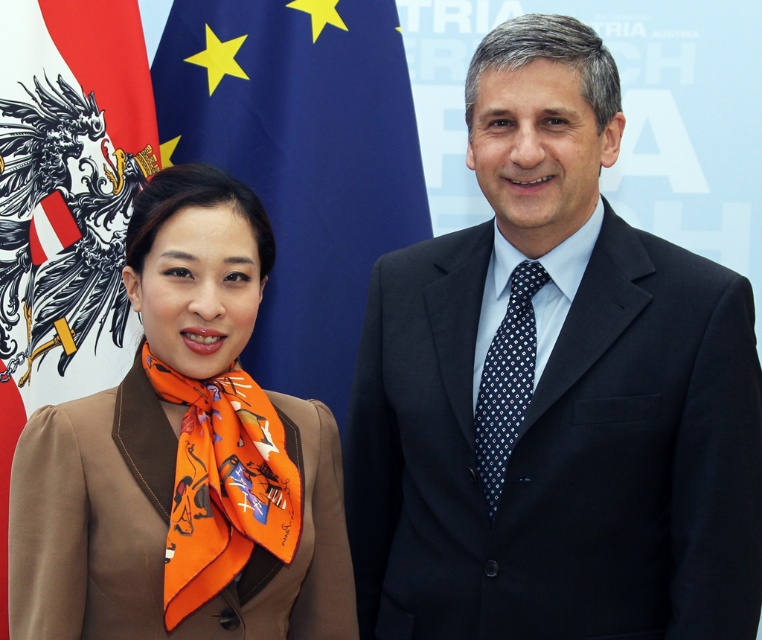
Image resolution: width=762 pixels, height=640 pixels. What do you see at coordinates (552, 392) in the screenshot? I see `dark blue suit at center` at bounding box center [552, 392].

Does dark blue suit at center appear over brown silk scarf at left?

Correct, dark blue suit at center is located above brown silk scarf at left.

The width and height of the screenshot is (762, 640). What do you see at coordinates (552, 392) in the screenshot? I see `dark blue suit at center` at bounding box center [552, 392].

Where is `dark blue suit at center`? Image resolution: width=762 pixels, height=640 pixels. dark blue suit at center is located at coordinates (552, 392).

Can you confirm if dark blue suit at center is positioned above dark blue silk tie at center?

Correct, dark blue suit at center is located above dark blue silk tie at center.

The height and width of the screenshot is (640, 762). Describe the element at coordinates (552, 392) in the screenshot. I see `dark blue suit at center` at that location.

Where is `dark blue suit at center`? dark blue suit at center is located at coordinates (552, 392).

Where is `dark blue suit at center`? This screenshot has width=762, height=640. dark blue suit at center is located at coordinates (552, 392).

Does point (71, 516) come in front of point (279, 28)?

Yes, point (71, 516) is in front of point (279, 28).

You are a GUI agent. You are given a task and a screenshot of the screen. Output one action in this format:
    pyautogui.click(x=<x>, y=<y>)
    Task: Click on the brown silk scarf at left
    Image resolution: width=762 pixels, height=640 pixels.
    Given the screenshot: What is the action you would take?
    coord(183,456)